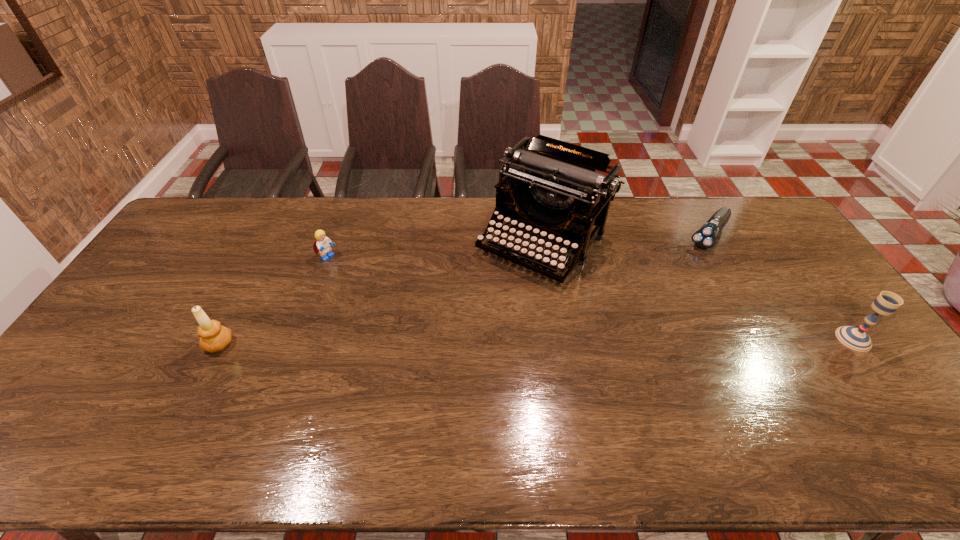
Find the location of a particular element. The height and width of the screenshot is (540, 960). candle_holder is located at coordinates 214,337.

Where is `the rightmost object`? The height and width of the screenshot is (540, 960). the rightmost object is located at coordinates (886, 303).

Locate an element on the screen. The image size is (960, 540). the fourth tallest object is located at coordinates (322, 244).

Find the location of a particular element. This screenshot has height=540, width=960. the fourth object from right to left is located at coordinates (322, 244).

Locate an element on the screen. The height and width of the screenshot is (540, 960). the third object from right to left is located at coordinates (557, 190).

The width and height of the screenshot is (960, 540). Identify the location of typewriter. (557, 190).

You are a GUI agent. You are given a task and a screenshot of the screen. Output one action in this format:
    pyautogui.click(x=<x>, y=<y>)
    Task: Click on the fourth object from left to right
    The height and width of the screenshot is (540, 960).
    Given the screenshot: What is the action you would take?
    pyautogui.click(x=705, y=237)

This screenshot has height=540, width=960. Identify the location of electric shaver. (705, 237).

At what (x,y) coordinates should I click in order to perform the action: click on vacant space situated on the left of the leftmost object. Please return your answer as a coordinate pair (x, y). The width and height of the screenshot is (960, 540). Looking at the image, I should click on (159, 344).

Locate an element on the screen. Image resolution: width=960 pixels, height=540 pixels. vacant space situated on the front of the rightmost object is located at coordinates (912, 417).